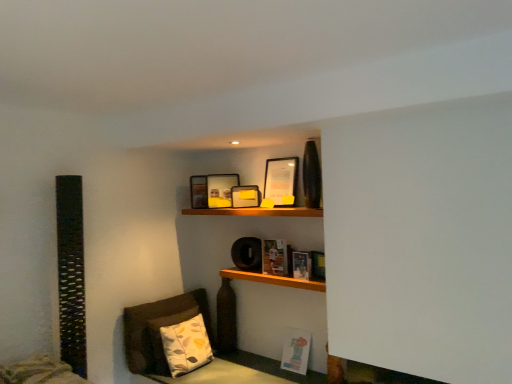
Question: From the image's perspective, is matte yellow picture frame at upper center, the third picture frame in the front-to-back sequence, located beneath hardcover book at center, arranged as the 2th book when ordered from the bottom?

Choices:
 (A) no
 (B) yes

Answer: (A)

Question: Is matte yellow picture frame at upper center, marked as the second picture frame in a back-to-front arrangement, smaller than hardcover book at center, the second book when ordered from top to bottom?

Choices:
 (A) no
 (B) yes

Answer: (A)

Question: Is matte yellow picture frame at upper center, the third picture frame in the front-to-back sequence, behind hardcover book at center, the second book when ordered from top to bottom?

Choices:
 (A) yes
 (B) no

Answer: (A)

Question: Does matte yellow picture frame at upper center, marked as the second picture frame in a back-to-front arrangement, have a greater width compared to hardcover book at center, the second book when ordered from top to bottom?

Choices:
 (A) no
 (B) yes

Answer: (B)

Question: Is matte yellow picture frame at upper center, the third picture frame in the front-to-back sequence, located outside hardcover book at center, the second book when ordered from top to bottom?

Choices:
 (A) no
 (B) yes

Answer: (B)

Question: Can you confirm if matte yellow picture frame at upper center, the third picture frame in the front-to-back sequence, is taller than hardcover book at center, the second book when ordered from top to bottom?

Choices:
 (A) yes
 (B) no

Answer: (A)

Question: Is matte paper book at center, which ranks as the 3th book in bottom-to-top order, next to matte black picture frame at upper center, which is counted as the first picture frame, starting from the front, and touching it?

Choices:
 (A) no
 (B) yes

Answer: (A)

Question: Does matte paper book at center, which ranks as the 3th book in bottom-to-top order, have a lesser width compared to matte black picture frame at upper center, which is counted as the first picture frame, starting from the front?

Choices:
 (A) yes
 (B) no

Answer: (B)

Question: Is matte paper book at center, which ranks as the 3th book in bottom-to-top order, to the right of matte black picture frame at upper center, which is the fourth picture frame from back to front, from the viewer's perspective?

Choices:
 (A) yes
 (B) no

Answer: (B)

Question: Could matte black picture frame at upper center, which is the fourth picture frame from back to front, be considered to be inside matte paper book at center, which ranks as the 3th book in bottom-to-top order?

Choices:
 (A) no
 (B) yes

Answer: (A)

Question: Is matte paper book at center, the 1th book viewed from the top, at the left side of matte black picture frame at upper center, which is counted as the first picture frame, starting from the front?

Choices:
 (A) no
 (B) yes

Answer: (B)

Question: From the image's perspective, is matte paper book at center, which ranks as the 3th book in bottom-to-top order, below matte black picture frame at upper center, which is the fourth picture frame from back to front?

Choices:
 (A) yes
 (B) no

Answer: (A)

Question: Is matte yellow picture frame at upper center, the third picture frame in the front-to-back sequence, a part of matte paper book at center, which ranks as the 3th book in bottom-to-top order?

Choices:
 (A) no
 (B) yes

Answer: (A)